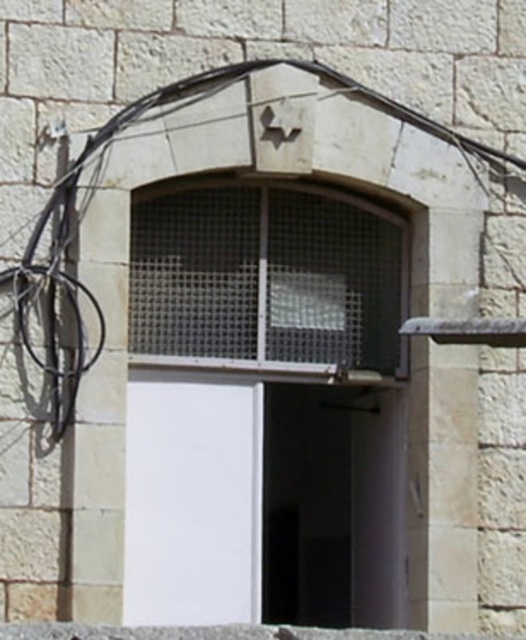
Question: Does metal mesh window at center appear over smooth concrete ledge at lower center?

Choices:
 (A) no
 (B) yes

Answer: (B)

Question: Among these objects, which one is farthest from the camera?

Choices:
 (A) smooth concrete ledge at lower center
 (B) black rubber wire at upper left
 (C) metal mesh window at center

Answer: (C)

Question: Which is farther from the black rubber wire at upper left?

Choices:
 (A) metal mesh window at center
 (B) smooth concrete ledge at lower center

Answer: (B)

Question: Considering the relative positions of black rubber wire at upper left and smooth concrete ledge at lower center in the image provided, where is black rubber wire at upper left located with respect to smooth concrete ledge at lower center?

Choices:
 (A) right
 (B) left

Answer: (A)

Question: Which object is farther from the camera taking this photo?

Choices:
 (A) black rubber wire at upper left
 (B) metal mesh window at center

Answer: (B)

Question: Can you confirm if black rubber wire at upper left is thinner than smooth concrete ledge at lower center?

Choices:
 (A) yes
 (B) no

Answer: (B)